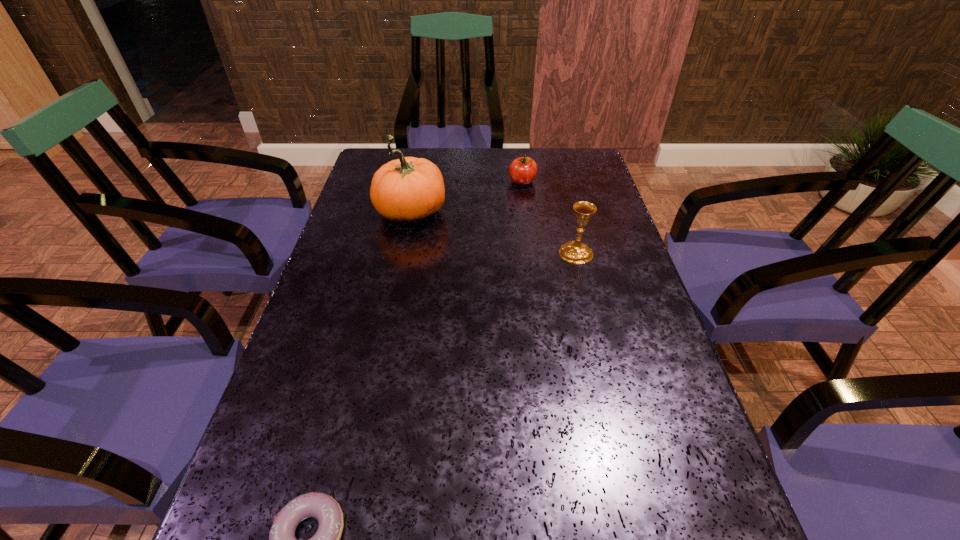
The height and width of the screenshot is (540, 960). In order to click on object that is at the left edge in this screenshot , I will do `click(407, 189)`.

The height and width of the screenshot is (540, 960). I want to click on object that is positioned at the right edge, so click(575, 252).

The width and height of the screenshot is (960, 540). I want to click on vacant space at the far edge of the desktop, so click(x=451, y=161).

Identify the location of vacant space at the left edge of the desktop. Image resolution: width=960 pixels, height=540 pixels. (280, 457).

The image size is (960, 540). I want to click on free space at the right edge of the desktop, so click(688, 444).

In order to click on vacant area at the far right corner of the desktop in this screenshot , I will do `click(562, 167)`.

This screenshot has width=960, height=540. Find the location of `free space between the farthest object and the tallest object`. free space between the farthest object and the tallest object is located at coordinates (467, 198).

I want to click on free space between the chalice and the pumpkin, so click(493, 233).

Identify the location of blank region between the chalice and the second object from right to left. The width and height of the screenshot is (960, 540). (549, 217).

Locate an element on the screen. empty space that is in between the third farthest object and the third nearest object is located at coordinates (493, 233).